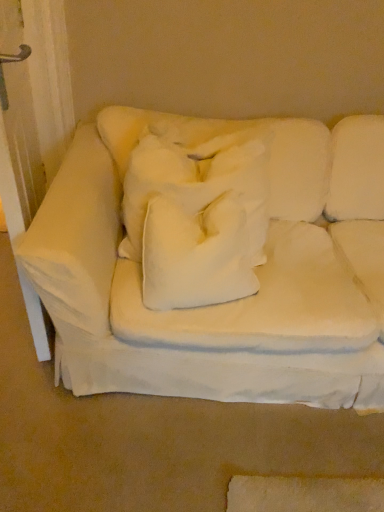
Question: Relative to white fabric couch at center, is white soft cushion at center in front or behind?

Choices:
 (A) front
 (B) behind

Answer: (B)

Question: Choose the correct answer: Is white soft cushion at center inside white fabric couch at center or outside it?

Choices:
 (A) inside
 (B) outside

Answer: (A)

Question: Does point (190, 272) appear closer or farther from the camera than point (129, 150)?

Choices:
 (A) closer
 (B) farther

Answer: (A)

Question: Is white fabric couch at center taller or shorter than white soft cushion at center?

Choices:
 (A) short
 (B) tall

Answer: (B)

Question: Considering the positions of point (46, 278) and point (215, 246), is point (46, 278) closer or farther from the camera than point (215, 246)?

Choices:
 (A) closer
 (B) farther

Answer: (A)

Question: Looking at their shapes, would you say white fabric couch at center is wider or thinner than white soft cushion at center?

Choices:
 (A) thin
 (B) wide

Answer: (B)

Question: Do you think white fabric couch at center is within white soft cushion at center, or outside of it?

Choices:
 (A) inside
 (B) outside

Answer: (B)